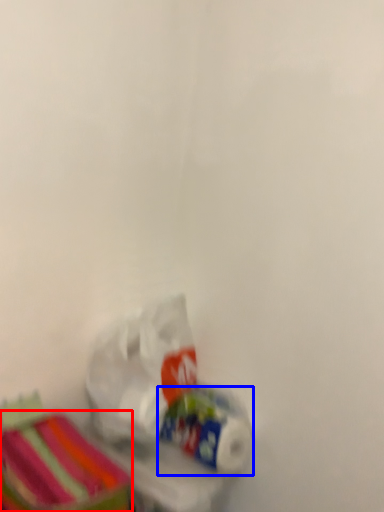
Question: Among these objects, which one is farthest to the camera, storage box (highlighted by a red box) or toilet paper (highlighted by a blue box)?

Choices:
 (A) storage box
 (B) toilet paper

Answer: (B)